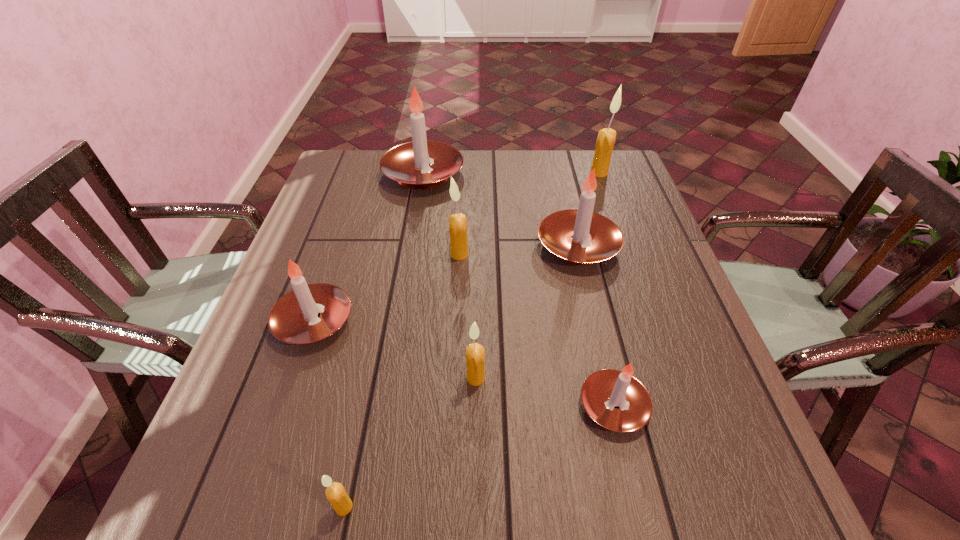
I want to click on the nearest white candle, so click(603, 390).

Locate an element on the screen. This screenshot has width=960, height=540. the leftmost cream candle is located at coordinates (335, 492).

Identify the location of the nearest cream candle. The image size is (960, 540). (335, 492).

Image resolution: width=960 pixels, height=540 pixels. Find the location of `vacant space located on the right of the farthest white candle`. vacant space located on the right of the farthest white candle is located at coordinates (526, 174).

Locate an element on the screen. The image size is (960, 540). vacant space located 0.080m on the left of the farthest cream candle is located at coordinates (564, 173).

Find the location of `vacant space located 0.100m on the back of the third smallest white candle`. vacant space located 0.100m on the back of the third smallest white candle is located at coordinates (566, 199).

At what (x,y) coordinates should I click in order to perform the action: click on vacant region located on the front of the second farthest cream candle. Please return your answer as a coordinate pair (x, y). Image resolution: width=960 pixels, height=540 pixels. Looking at the image, I should click on (458, 293).

At what (x,y) coordinates should I click in order to perform the action: click on vacant area situated 0.250m on the back of the third farthest white candle. Please return your answer as a coordinate pair (x, y). Looking at the image, I should click on (348, 224).

Identify the location of free location located on the front of the second smallest cream candle. The height and width of the screenshot is (540, 960). (475, 485).

The height and width of the screenshot is (540, 960). What are the coordinates of `vacant area situated 0.080m on the right of the smallest white candle` in the screenshot? It's located at (692, 406).